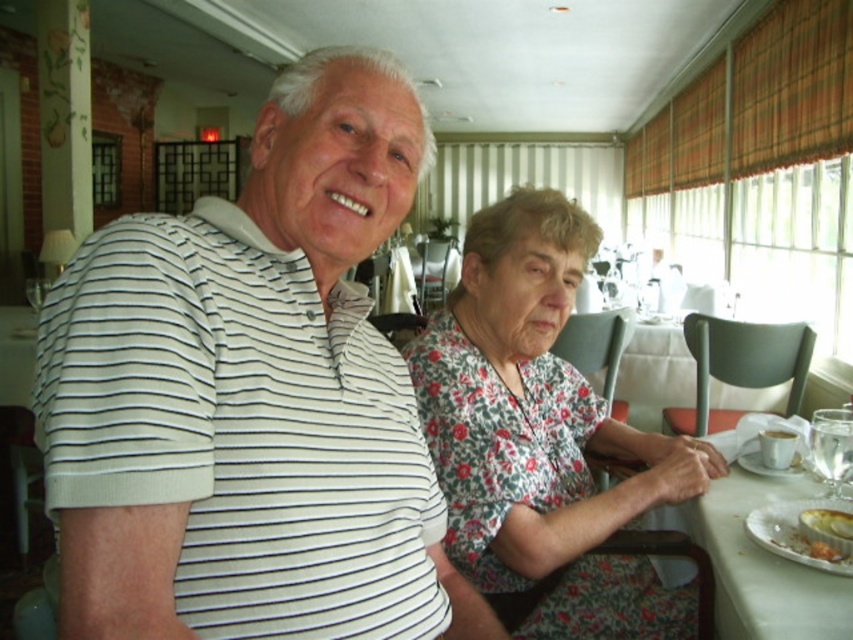
Question: Does floral fabric dress at center appear under white cloth table at lower right?

Choices:
 (A) yes
 (B) no

Answer: (B)

Question: Does white cloth table at lower right have a lesser width compared to white porcelain plate at lower right?

Choices:
 (A) yes
 (B) no

Answer: (B)

Question: Is white striped polo shirt at left below white porcelain plate at lower right?

Choices:
 (A) yes
 (B) no

Answer: (B)

Question: Among these objects, which one is farthest from the camera?

Choices:
 (A) white porcelain plate at lower right
 (B) floral fabric dress at center

Answer: (B)

Question: Among these objects, which one is farthest from the camera?

Choices:
 (A) white cloth table at lower right
 (B) white striped polo shirt at left
 (C) floral fabric dress at center

Answer: (C)

Question: Among these points, which one is nearest to the camera?

Choices:
 (A) (508, 202)
 (B) (828, 572)
 (C) (630, 472)

Answer: (B)